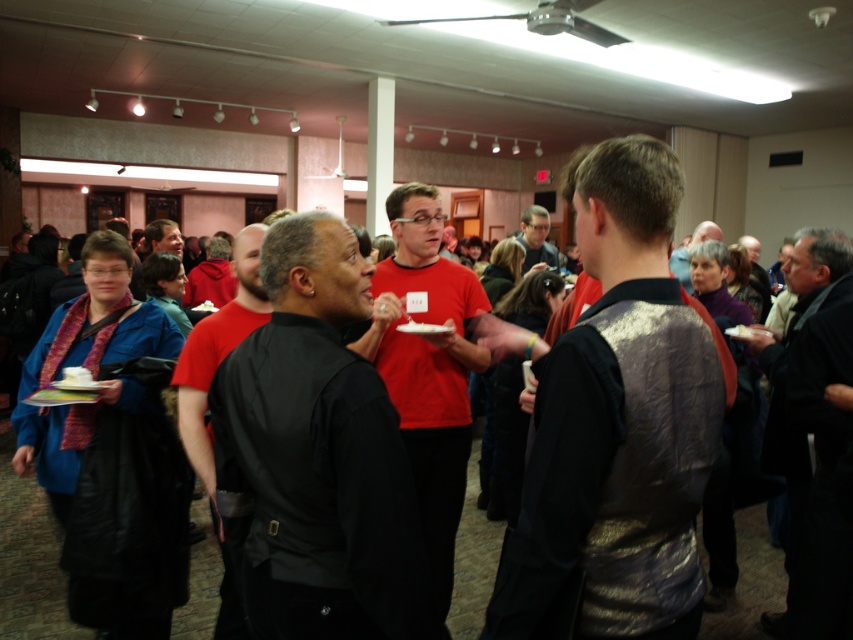
Question: Which object appears farthest from the camera in this image?

Choices:
 (A) black matte shirt at center
 (B) matte black vest at center
 (C) matte black shirt at center

Answer: (C)

Question: Which point is closer to the camera taking this photo?

Choices:
 (A) (833, 445)
 (B) (335, 292)

Answer: (B)

Question: Is shiny metallic vest at center above black leather jacket at center?

Choices:
 (A) yes
 (B) no

Answer: (A)

Question: Does matte black shirt at center have a larger size compared to matte black vest at center?

Choices:
 (A) yes
 (B) no

Answer: (B)

Question: Which point appears farthest from the camera in this image?

Choices:
 (A) (202, 481)
 (B) (477, 292)
 (C) (619, 579)

Answer: (B)

Question: Does black leather jacket at right appear over matte black shirt at center?

Choices:
 (A) no
 (B) yes

Answer: (A)